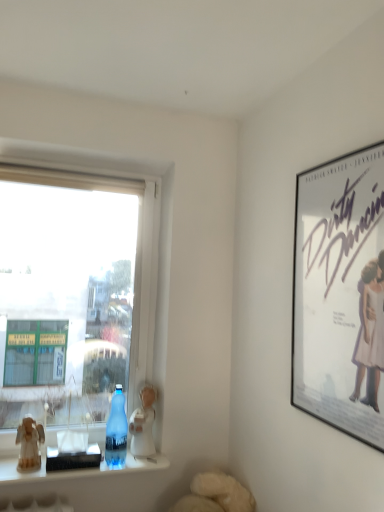
Image resolution: width=384 pixels, height=512 pixels. What do you see at coordinates (73, 293) in the screenshot? I see `transparent glass window at left` at bounding box center [73, 293].

What are the coordinates of `white porcelain figurine at lower center, placed as the 1th figurine when sorted from back to front` in the screenshot? It's located at (143, 423).

Where is `translucent glass water at lower left`? translucent glass water at lower left is located at coordinates (77, 470).

Where is `white matte poster at upper right`? white matte poster at upper right is located at coordinates (340, 294).

Which is nearer, (52, 397) or (32, 463)?

Point (52, 397) is farther from the camera than point (32, 463).

Are transparent glass window at left and wooden figurine at left, the 1th figurine viewed from the front, located far from each other?

transparent glass window at left is near wooden figurine at left, the 1th figurine viewed from the front, not far away.

Between transparent glass window at left and wooden figurine at left, which ranks as the first figurine in left-to-right order, which one has less height?

Standing shorter between the two is wooden figurine at left, which ranks as the first figurine in left-to-right order.

Considering the sizes of transparent glass window at left and wooden figurine at left, marked as the second figurine in a back-to-front arrangement, in the image, is transparent glass window at left wider or thinner than wooden figurine at left, marked as the second figurine in a back-to-front arrangement,?

In the image, transparent glass window at left appears to be wider than wooden figurine at left, marked as the second figurine in a back-to-front arrangement.

Is transparent glass bottle at window in contact with wooden figurine at left, the 2th figurine when ordered from right to left?

transparent glass bottle at window is not next to wooden figurine at left, the 2th figurine when ordered from right to left, and they're not touching.

Considering the relative sizes of transparent glass bottle at window and wooden figurine at left, marked as the second figurine in a back-to-front arrangement, in the image provided, is transparent glass bottle at window smaller than wooden figurine at left, marked as the second figurine in a back-to-front arrangement,?

Incorrect, transparent glass bottle at window is not smaller in size than wooden figurine at left, marked as the second figurine in a back-to-front arrangement.

From a real-world perspective, between transparent glass bottle at window and wooden figurine at left, the 2th figurine when ordered from right to left, who is vertically higher?

In real-world perspective, transparent glass bottle at window is above.

How far apart are transparent glass bottle at window and wooden figurine at left, the 1th figurine viewed from the front?

A distance of 13.25 inches exists between transparent glass bottle at window and wooden figurine at left, the 1th figurine viewed from the front.

Could you tell me if transparent glass bottle at window is facing white matte poster at upper right?

No, transparent glass bottle at window does not turn towards white matte poster at upper right.

Is transparent glass bottle at window taller or shorter than white matte poster at upper right?

transparent glass bottle at window is shorter than white matte poster at upper right.

Does point (124, 443) lie in front of point (327, 228)?

No, (124, 443) is behind (327, 228).

From the image's perspective, does transparent glass bottle at window appear higher than white matte poster at upper right?

No, from the image's perspective, transparent glass bottle at window is not over white matte poster at upper right.

Is white matte poster at upper right to the left or to the right of translucent glass water at lower left in the image?

Based on their positions, white matte poster at upper right is located to the right of translucent glass water at lower left.

Is white matte poster at upper right not near translucent glass water at lower left?

Absolutely, white matte poster at upper right is distant from translucent glass water at lower left.

Could you tell me if white matte poster at upper right is turned towards translucent glass water at lower left?

No, white matte poster at upper right is not aimed at translucent glass water at lower left.

Is translucent glass water at lower left positioned with its back to white porcelain figurine at lower center, acting as the second figurine starting from the front?

No, translucent glass water at lower left's orientation is not away from white porcelain figurine at lower center, acting as the second figurine starting from the front.

Can you confirm if translucent glass water at lower left is taller than white porcelain figurine at lower center, acting as the second figurine starting from the front?

In fact, translucent glass water at lower left may be shorter than white porcelain figurine at lower center, acting as the second figurine starting from the front.

What's the angular difference between translucent glass water at lower left and white porcelain figurine at lower center, which ranks as the 1th figurine in right-to-left order,'s facing directions?

The facing directions of translucent glass water at lower left and white porcelain figurine at lower center, which ranks as the 1th figurine in right-to-left order, are 29.6 degrees apart.

Image resolution: width=384 pixels, height=512 pixels. I want to click on figurine on the right of translucent glass water at lower left, so click(x=143, y=423).

Is translucent glass water at lower left positioned with its back to wooden figurine at left, the 1th figurine viewed from the front?

No, translucent glass water at lower left is not facing the opposite direction of wooden figurine at left, the 1th figurine viewed from the front.

Is translucent glass water at lower left far away from wooden figurine at left, which ranks as the first figurine in left-to-right order?

No, translucent glass water at lower left is in close proximity to wooden figurine at left, which ranks as the first figurine in left-to-right order.

Which is more to the right, translucent glass water at lower left or wooden figurine at left, marked as the second figurine in a back-to-front arrangement?

From the viewer's perspective, translucent glass water at lower left appears more on the right side.

Is translucent glass water at lower left wider or thinner than wooden figurine at left, marked as the second figurine in a back-to-front arrangement?

In the image, translucent glass water at lower left appears to be wider than wooden figurine at left, marked as the second figurine in a back-to-front arrangement.

From the image's perspective, which one is positioned higher, wooden figurine at left, the 1th figurine viewed from the front, or transparent glass window at left?

transparent glass window at left.

What's the angular difference between wooden figurine at left, marked as the second figurine in a back-to-front arrangement, and transparent glass window at left's facing directions?

The angular difference between wooden figurine at left, marked as the second figurine in a back-to-front arrangement, and transparent glass window at left is 1.62 degrees.

Is there a large distance between wooden figurine at left, the 2th figurine when ordered from right to left, and transparent glass window at left?

That's not correct — wooden figurine at left, the 2th figurine when ordered from right to left, is a little close to transparent glass window at left.

This screenshot has width=384, height=512. Find the location of `figurine that is the 2nd one when counting downward from the transparent glass window at left (from the image's perspective)`. figurine that is the 2nd one when counting downward from the transparent glass window at left (from the image's perspective) is located at coordinates (29, 444).

Identify the location of figurine located on the left of transparent glass bottle at window. (29, 444).

When comparing their distances from wooden figurine at left, the 1th figurine viewed from the front, does translucent glass water at lower left or transparent glass window at left seem closer?

Based on the image, translucent glass water at lower left appears to be nearer to wooden figurine at left, the 1th figurine viewed from the front.

Considering their positions, is white matte poster at upper right positioned closer to wooden figurine at left, marked as the second figurine in a back-to-front arrangement, than white porcelain figurine at lower center, which ranks as the 1th figurine in right-to-left order?

white porcelain figurine at lower center, which ranks as the 1th figurine in right-to-left order, lies closer to wooden figurine at left, marked as the second figurine in a back-to-front arrangement, than the other object.

Based on their spatial positions, is transparent glass bottle at window or translucent glass water at lower left closer to white matte poster at upper right?

transparent glass bottle at window is positioned closer to the anchor white matte poster at upper right.

Looking at the image, which one is located further to white porcelain figurine at lower center, placed as the 1th figurine when sorted from back to front, transparent glass window at left or wooden figurine at left, the 1th figurine viewed from the front?

wooden figurine at left, the 1th figurine viewed from the front, is further to white porcelain figurine at lower center, placed as the 1th figurine when sorted from back to front.

When comparing their distances from white porcelain figurine at lower center, the 2th figurine when ordered from left to right, does white matte poster at upper right or transparent glass bottle at window seem closer?

transparent glass bottle at window is closer to white porcelain figurine at lower center, the 2th figurine when ordered from left to right.

Estimate the real-world distances between objects in this image. Which object is closer to wooden figurine at left, the 2th figurine when ordered from right to left, white porcelain figurine at lower center, placed as the 1th figurine when sorted from back to front, or transparent glass window at left?

white porcelain figurine at lower center, placed as the 1th figurine when sorted from back to front, is positioned closer to the anchor wooden figurine at left, the 2th figurine when ordered from right to left.

Looking at the image, which one is located further to translucent glass water at lower left, white porcelain figurine at lower center, placed as the 1th figurine when sorted from back to front, or transparent glass bottle at window?

white porcelain figurine at lower center, placed as the 1th figurine when sorted from back to front, is further to translucent glass water at lower left.

Which object lies nearer to the anchor point white porcelain figurine at lower center, the 2th figurine when ordered from left to right, transparent glass window at left or white matte poster at upper right?

transparent glass window at left.

This screenshot has height=512, width=384. Find the location of `bottle between transparent glass window at left and translucent glass water at lower left from top to bottom`. bottle between transparent glass window at left and translucent glass water at lower left from top to bottom is located at coordinates (116, 431).

The width and height of the screenshot is (384, 512). I want to click on bottle between transparent glass window at left and white porcelain figurine at lower center, acting as the second figurine starting from the front, in the vertical direction, so click(116, 431).

Where is `window between wooden figurine at left, the 1th figurine viewed from the front, and white matte poster at upper right from left to right`? The height and width of the screenshot is (512, 384). window between wooden figurine at left, the 1th figurine viewed from the front, and white matte poster at upper right from left to right is located at coordinates (73, 293).

Identify the location of figurine between wooden figurine at left, which ranks as the first figurine in left-to-right order, and white matte poster at upper right, in the horizontal direction. (143, 423).